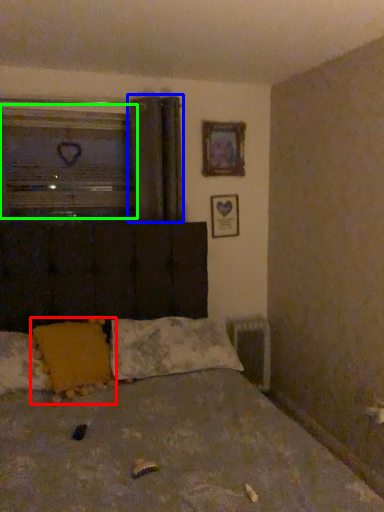
Question: Considering the real-world distances, which object is closest to pillow (highlighted by a red box)? curtain (highlighted by a blue box) or window (highlighted by a green box).

Choices:
 (A) curtain
 (B) window

Answer: (A)